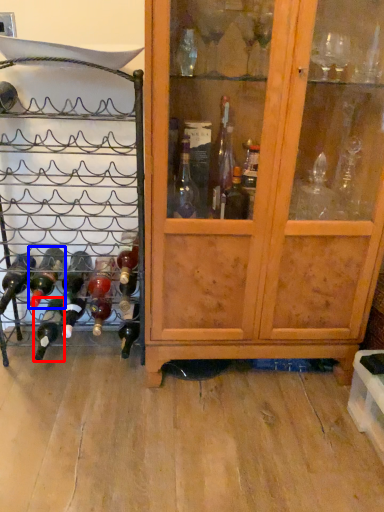
Question: Which object is closer to the camera taking this photo, bottle (highlighted by a red box) or bottle (highlighted by a blue box)?

Choices:
 (A) bottle
 (B) bottle

Answer: (B)